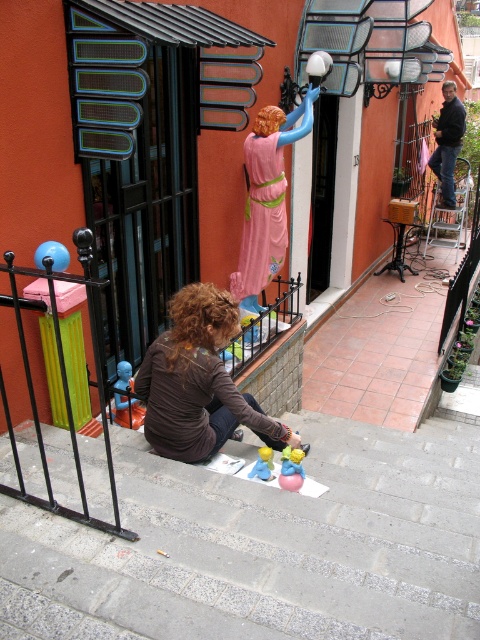
You are a photographer trying to capture a closeup of the blue plastic toy at lower left without the matte plastic toy at center appearing in the shot. Based on their positions, is this possible?

The matte plastic toy at center is behind the blue plastic toy at lower left, so it won not be visible in the closeup if the photographer focuses on the blue plastic toy at lower left and uses a shallow depth of field.

You are standing at a point in the scene where you can see both point (123, 374) and point (269, 476). Which point is closer to you?

Point (269, 476) is closer to you because according to the description, point (123, 374) is behind point (269, 476).

You are a photographer trying to capture the scene of the woman and her figurines. You want to ensure that both the blue plastic toy at lower left and the matte plastic toy at center are visible in the frame. Based on their positions, which toy is located to the left of the other?

The blue plastic toy at lower left is positioned on the left side of matte plastic toy at center, so the blue plastic toy at lower left is to the left of the matte plastic toy at center.